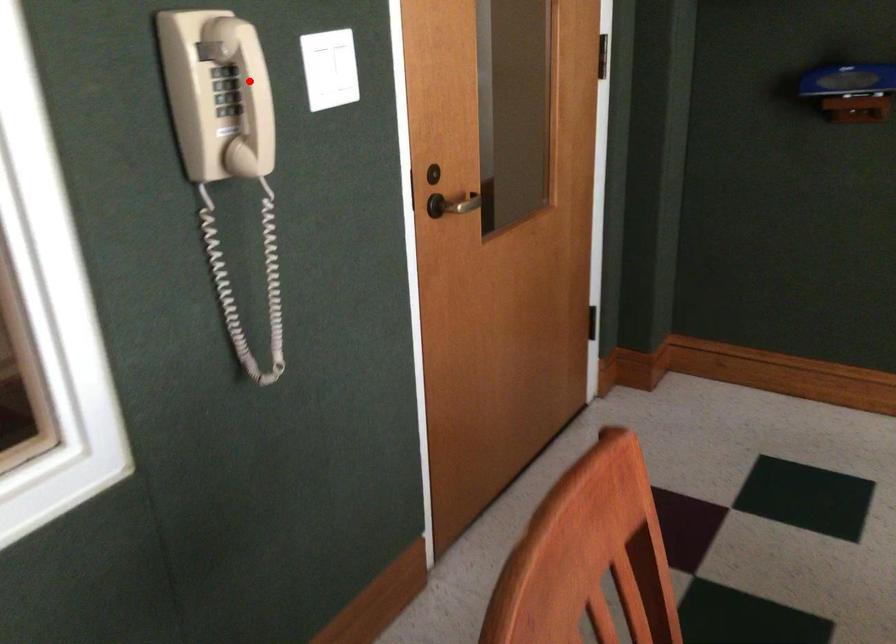
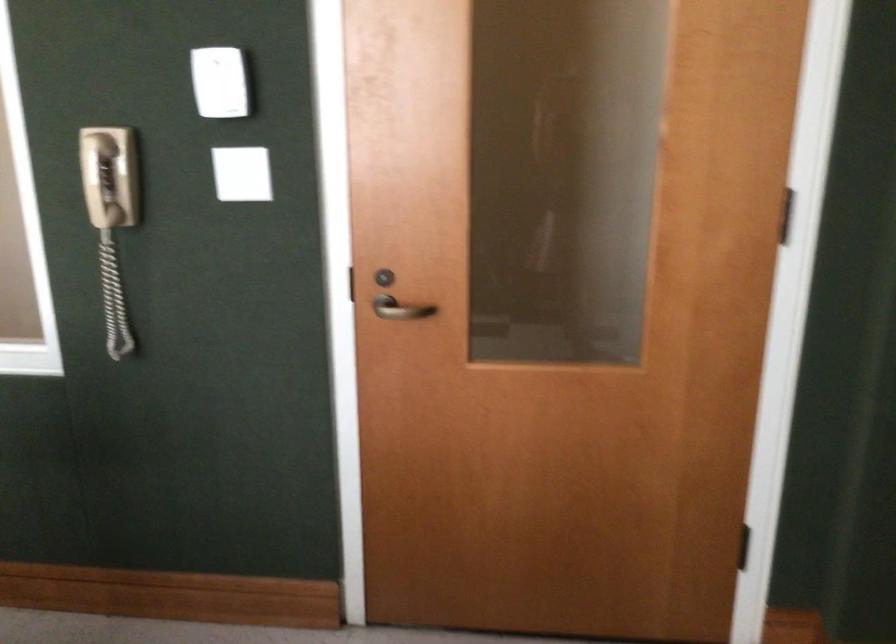
Locate, in the second image, the point that corresponds to the highlighted location in the first image.

(99, 180)